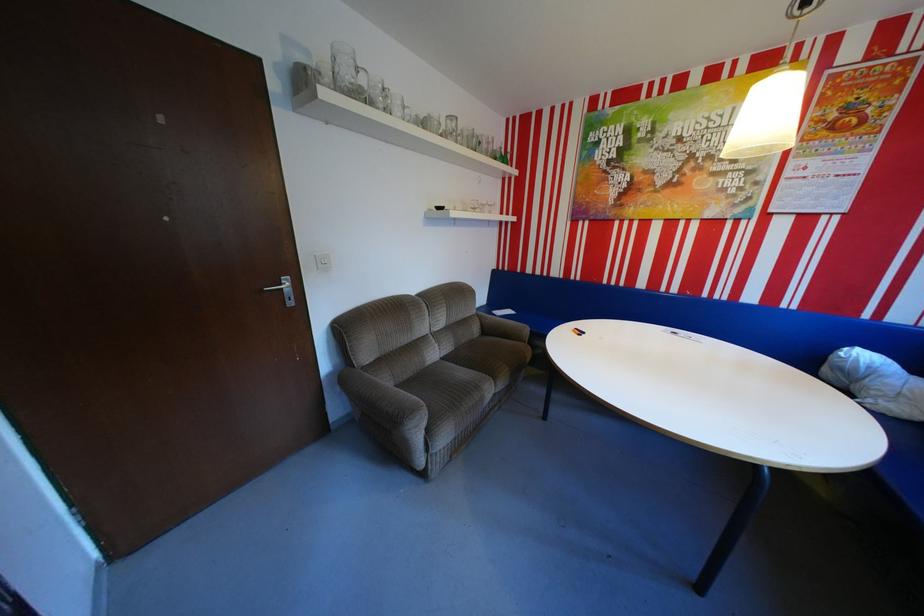
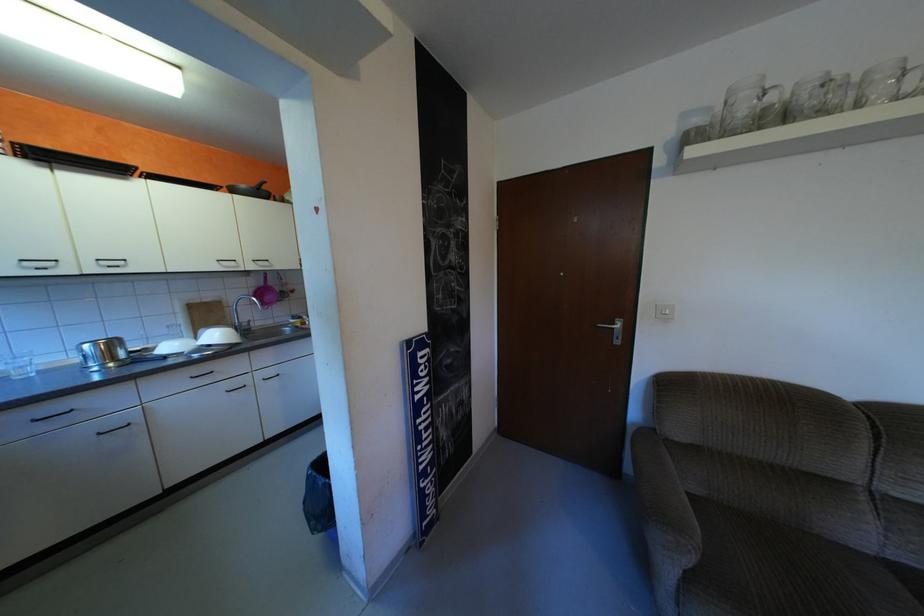
Question: The images are taken continuously from a first-person perspective. In which direction is your viewpoint rotating?

Choices:
 (A) Left
 (B) Right
 (C) Up
 (D) Down

Answer: (A)